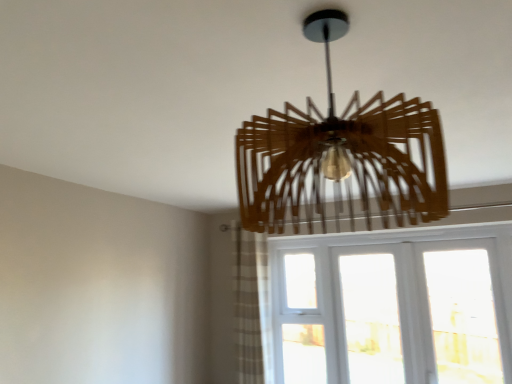
The height and width of the screenshot is (384, 512). Describe the element at coordinates (251, 305) in the screenshot. I see `plaid fabric curtain at lower center` at that location.

Consider the image. What is the approximate height of plaid fabric curtain at lower center?

plaid fabric curtain at lower center is 1.18 meters tall.

The width and height of the screenshot is (512, 384). I want to click on plaid fabric curtain at lower center, so click(x=251, y=305).

Considering the sizes of objects plaid fabric curtain at lower center and wooden chandelier at center in the image provided, who is bigger, plaid fabric curtain at lower center or wooden chandelier at center?

With larger size is plaid fabric curtain at lower center.

From a real-world perspective, which object stands above the other?

wooden chandelier at center.

Is plaid fabric curtain at lower center positioned with its back to wooden chandelier at center?

No, wooden chandelier at center is not at the back of plaid fabric curtain at lower center.

Can you confirm if plaid fabric curtain at lower center is taller than wooden chandelier at center?

Yes, plaid fabric curtain at lower center is taller than wooden chandelier at center.

Can you tell me how much wooden chandelier at center and plaid fabric curtain at lower center differ in facing direction?

0.521 degrees separate the facing orientations of wooden chandelier at center and plaid fabric curtain at lower center.

Is wooden chandelier at center not close to plaid fabric curtain at lower center?

Yes, wooden chandelier at center and plaid fabric curtain at lower center are quite far apart.

Is wooden chandelier at center to the left or to the right of plaid fabric curtain at lower center in the image?

From the image, it's evident that wooden chandelier at center is to the right of plaid fabric curtain at lower center.

Considering the points (244, 122) and (234, 282), which point is behind, point (244, 122) or point (234, 282)?

The point (234, 282) is farther.

From a real-world perspective, is plaid fabric curtain at lower center positioned above or below white textured glass at lower right?

plaid fabric curtain at lower center is situated higher than white textured glass at lower right in the real world.

Is plaid fabric curtain at lower center outside of white textured glass at lower right?

Yes, plaid fabric curtain at lower center is outside of white textured glass at lower right.

From the image's perspective, which one is positioned lower, plaid fabric curtain at lower center or white textured glass at lower right?

white textured glass at lower right.

Considering the relative sizes of wooden chandelier at center and white textured glass at lower right in the image provided, is wooden chandelier at center smaller than white textured glass at lower right?

Yes.

From a real-world perspective, is wooden chandelier at center located higher than white textured glass at lower right?

Indeed, from a real-world perspective, wooden chandelier at center stands above white textured glass at lower right.

Who is shorter, wooden chandelier at center or white textured glass at lower right?

Standing shorter between the two is wooden chandelier at center.

Could you tell me if wooden chandelier at center is facing white textured glass at lower right?

No.

Is white textured glass at lower right turned away from plaid fabric curtain at lower center?

No.

Considering the positions of points (406, 236) and (253, 296), is point (406, 236) closer to camera compared to point (253, 296)?

Yes, point (406, 236) is in front of point (253, 296).

The width and height of the screenshot is (512, 384). Find the location of `curtain above the white textured glass at lower right (from a real-world perspective)`. curtain above the white textured glass at lower right (from a real-world perspective) is located at coordinates (251, 305).

From the image's perspective, is white textured glass at lower right under wooden chandelier at center?

Yes, from the image's perspective, white textured glass at lower right is below wooden chandelier at center.

Would you say white textured glass at lower right is a long distance from wooden chandelier at center?

white textured glass at lower right is far away from wooden chandelier at center.

How far apart are white textured glass at lower right and wooden chandelier at center?

They are 5.43 feet apart.

In the image, there is a wooden chandelier at center. What are the coordinates of `curtain below it (from the image's perspective)` in the screenshot? It's located at (251, 305).

Identify the location of lamp positioned vertically above the plaid fabric curtain at lower center (from a real-world perspective). (340, 157).

Estimate the real-world distances between objects in this image. Which object is closer to wooden chandelier at center, white textured glass at lower right or plaid fabric curtain at lower center?

Among the two, plaid fabric curtain at lower center is located nearer to wooden chandelier at center.

Estimate the real-world distances between objects in this image. Which object is closer to wooden chandelier at center, plaid fabric curtain at lower center or white textured glass at lower right?

plaid fabric curtain at lower center lies closer to wooden chandelier at center than the other object.

Which object lies further to the anchor point white textured glass at lower right, wooden chandelier at center or plaid fabric curtain at lower center?

wooden chandelier at center is further to white textured glass at lower right.

Considering their positions, is wooden chandelier at center positioned closer to plaid fabric curtain at lower center than white textured glass at lower right?

white textured glass at lower right.

Looking at the image, which one is located closer to white textured glass at lower right, plaid fabric curtain at lower center or wooden chandelier at center?

plaid fabric curtain at lower center is closer to white textured glass at lower right.

Consider the image. From the image, which object appears to be nearer to plaid fabric curtain at lower center, white textured glass at lower right or wooden chandelier at center?

white textured glass at lower right lies closer to plaid fabric curtain at lower center than the other object.

You are a GUI agent. You are given a task and a screenshot of the screen. Output one action in this format:
    pyautogui.click(x=<x>, y=<y>)
    Task: Click on the window located between wooden chandelier at center and plaid fabric curtain at lower center in the depth direction
    
    Given the screenshot: What is the action you would take?
    pyautogui.click(x=392, y=306)